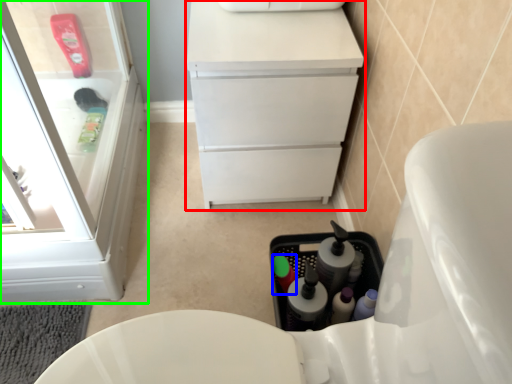
Question: Which object is the farthest from vanity (highlighted by a red box)? Choose among these: bottle (highlighted by a blue box) or bathroom cabinet (highlighted by a green box).

Choices:
 (A) bottle
 (B) bathroom cabinet

Answer: (B)